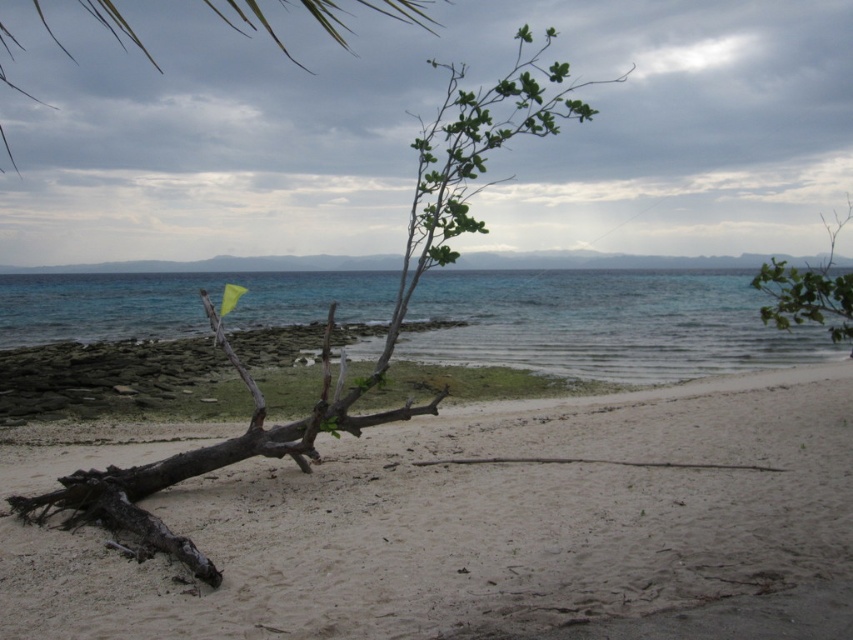
You are a bird looking for a place to perch. There are two branches available in the scene. The first is the green leafy branch at upper center, and the second is the green leafy branch at upper right. Which branch is farther from the other?

Both branches are 162.68 feet apart from each other, so they are equally distant from one another.

You are a photographer trying to capture the green leafy branch at upper right and the clear blue water at center in a single shot. Which object will appear closer to the camera in the photo?

The clear blue water at center will appear closer to the camera because the green leafy branch at upper right is behind it.

You are a beachcomber searching for items on the beach. You see the brown rough wood at center and the green leafy branch at upper center. Which object is closer to the ocean?

The brown rough wood at center is positioned under the green leafy branch at upper center, meaning the brown rough wood at center is closer to the ocean than the green leafy branch at upper center.